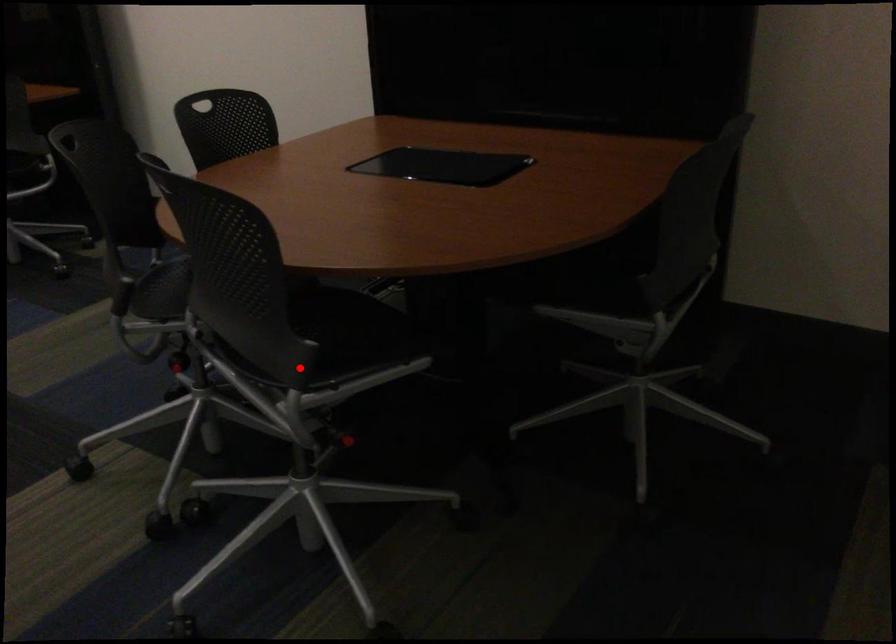
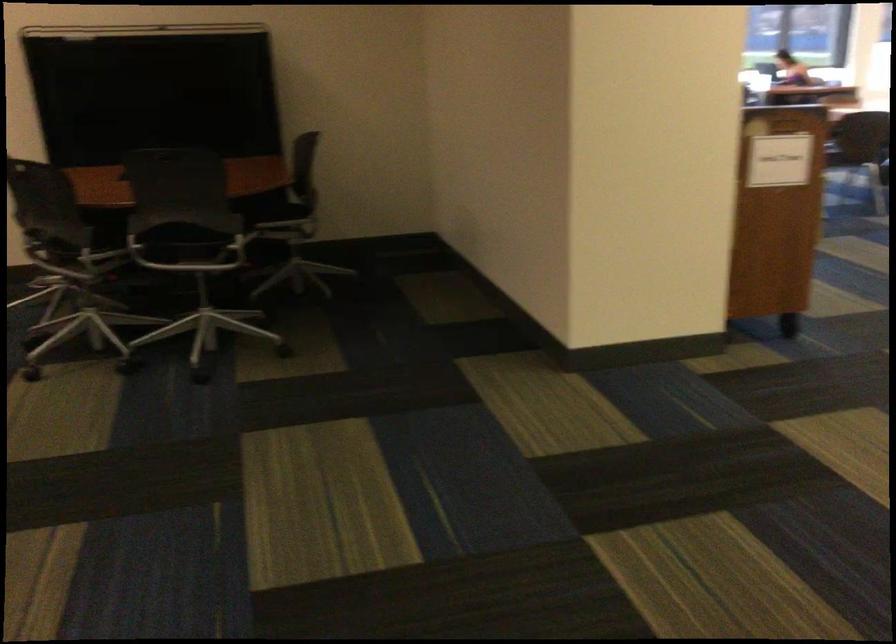
Question: I am providing you with two images of the same scene from different viewpoints. A red point is marked on the first image. Is the red point's position out of view in image 2?

Choices:
 (A) Yes
 (B) No

Answer: (A)